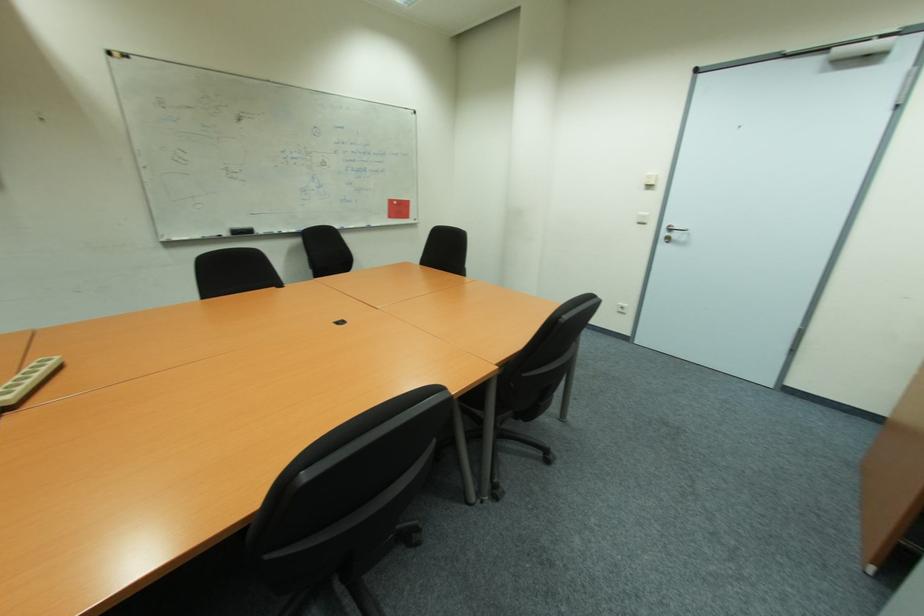
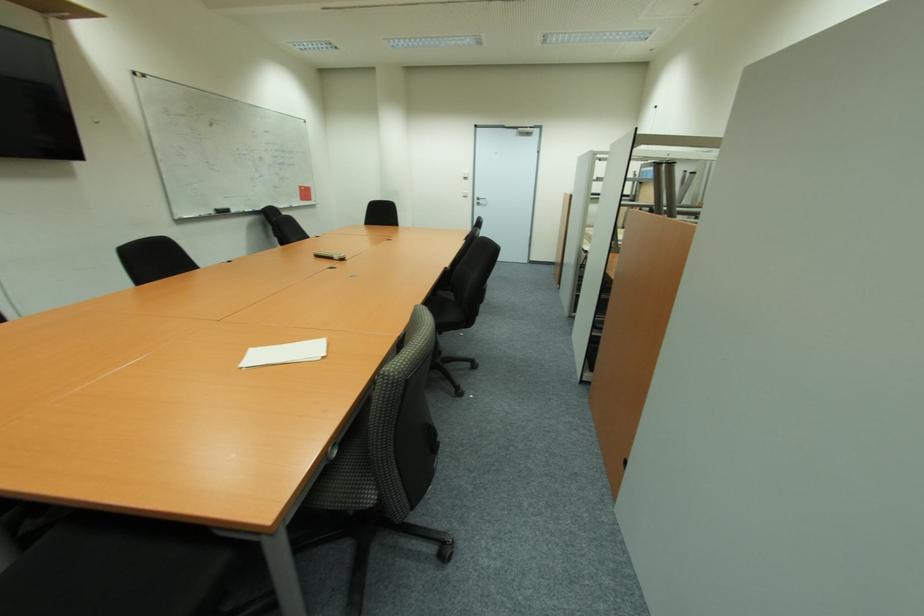
Find the pixel in the second image that matches point (229, 233) in the first image.

(215, 214)